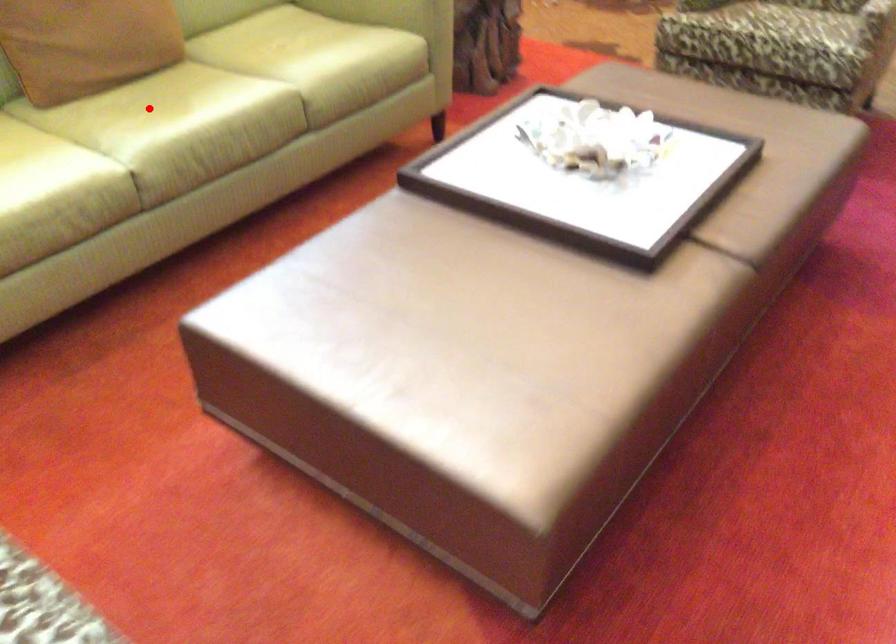
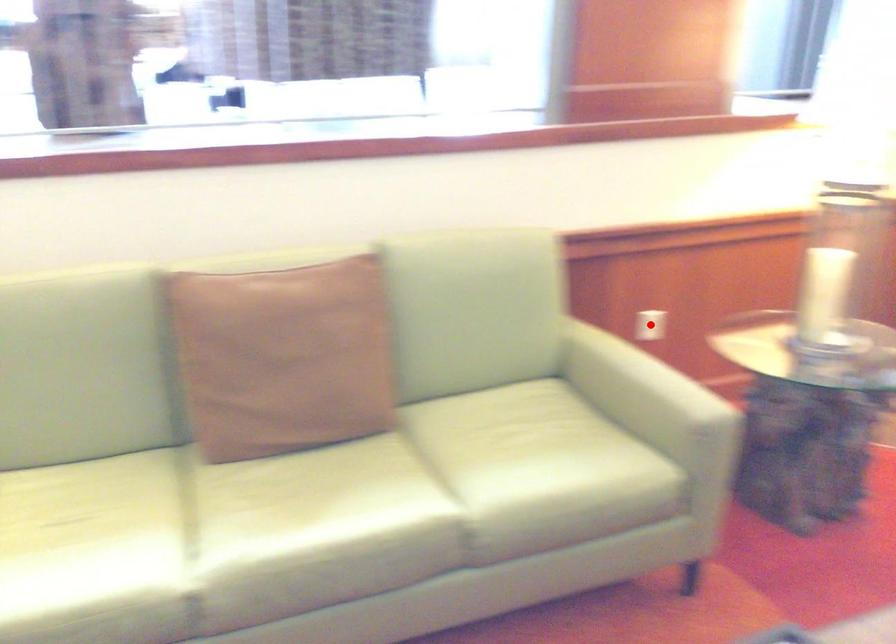
I am providing you with two images of the same scene from different viewpoints. A red point is marked on the first image and another point is marked on the second image. Is the marked point in image1 the same physical position as the marked point in image2?

No